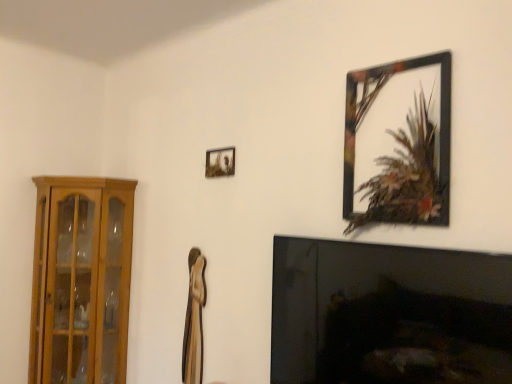
Question: Does metallic silver photo frame at upper center, which appears as the 2th picture frame when viewed from the right, lie in front of wooden cabinet at left?

Choices:
 (A) no
 (B) yes

Answer: (B)

Question: Can you confirm if metallic silver photo frame at upper center, placed as the first picture frame when sorted from back to front, is thinner than wooden cabinet at left?

Choices:
 (A) no
 (B) yes

Answer: (B)

Question: Does metallic silver photo frame at upper center, which appears as the 2th picture frame when viewed from the right, have a greater height compared to wooden cabinet at left?

Choices:
 (A) yes
 (B) no

Answer: (B)

Question: From the image's perspective, is metallic silver photo frame at upper center, the second picture frame viewed from the front, on wooden cabinet at left?

Choices:
 (A) yes
 (B) no

Answer: (A)

Question: Considering the relative positions of metallic silver photo frame at upper center, which appears as the 2th picture frame when viewed from the right, and wooden cabinet at left in the image provided, is metallic silver photo frame at upper center, which appears as the 2th picture frame when viewed from the right, to the left of wooden cabinet at left from the viewer's perspective?

Choices:
 (A) no
 (B) yes

Answer: (A)

Question: Does point (380, 114) appear closer or farther from the camera than point (211, 163)?

Choices:
 (A) farther
 (B) closer

Answer: (B)

Question: Visually, is metallic black picture frame at upper right, which is the first picture frame in right-to-left order, positioned to the left or to the right of metallic silver photo frame at upper center, positioned as the 1th picture frame in left-to-right order?

Choices:
 (A) left
 (B) right

Answer: (B)

Question: In terms of size, does metallic black picture frame at upper right, which is the first picture frame in right-to-left order, appear bigger or smaller than metallic silver photo frame at upper center, which appears as the 2th picture frame when viewed from the right?

Choices:
 (A) small
 (B) big

Answer: (B)

Question: From the image's perspective, relative to metallic silver photo frame at upper center, positioned as the 1th picture frame in left-to-right order, is metallic black picture frame at upper right, the first picture frame viewed from the front, above or below?

Choices:
 (A) above
 (B) below

Answer: (A)

Question: Looking at their shapes, would you say black glass fireplace at lower right is wider or thinner than metallic silver photo frame at upper center, which appears as the 2th picture frame when viewed from the right?

Choices:
 (A) thin
 (B) wide

Answer: (B)

Question: Based on their sizes in the image, would you say black glass fireplace at lower right is bigger or smaller than metallic silver photo frame at upper center, the second picture frame viewed from the front?

Choices:
 (A) small
 (B) big

Answer: (B)

Question: From the image's perspective, relative to metallic silver photo frame at upper center, positioned as the 1th picture frame in left-to-right order, is black glass fireplace at lower right above or below?

Choices:
 (A) below
 (B) above

Answer: (A)

Question: From their relative heights in the image, would you say black glass fireplace at lower right is taller or shorter than metallic silver photo frame at upper center, the second picture frame viewed from the front?

Choices:
 (A) tall
 (B) short

Answer: (A)

Question: Considering the positions of metallic silver photo frame at upper center, which appears as the 2th picture frame when viewed from the right, and wooden cabinet at left in the image, is metallic silver photo frame at upper center, which appears as the 2th picture frame when viewed from the right, wider or thinner than wooden cabinet at left?

Choices:
 (A) thin
 (B) wide

Answer: (A)

Question: Choose the correct answer: Is metallic silver photo frame at upper center, placed as the first picture frame when sorted from back to front, inside wooden cabinet at left or outside it?

Choices:
 (A) outside
 (B) inside

Answer: (A)